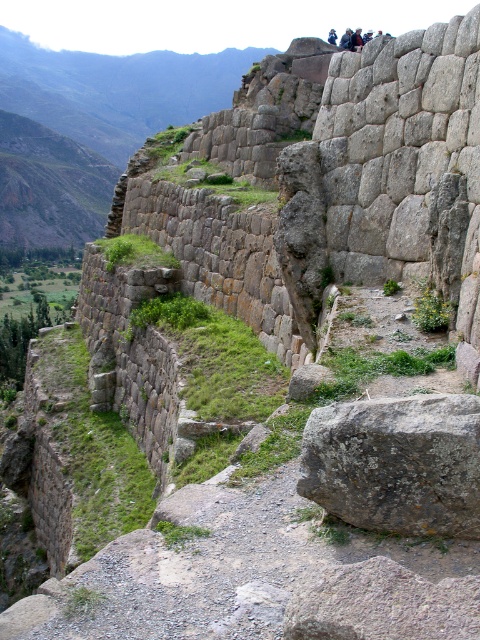
You are standing in front of an ancient Incan stone wall. You see a gray rough rock at center and a dark hair person at upper center. Which object is positioned to the left side?

The gray rough rock at center is positioned to the left of the dark hair person at upper center.

Looking at this image, you are a tour guide explaining the ancient stone wall to visitors. Pointing to the dark blue fabric at upper center and the dark hair person at upper center, you want to describe their positions relative to each other. Which object is located to the right of the other?

The dark blue fabric at upper center is to the right of the dark hair person at upper center.